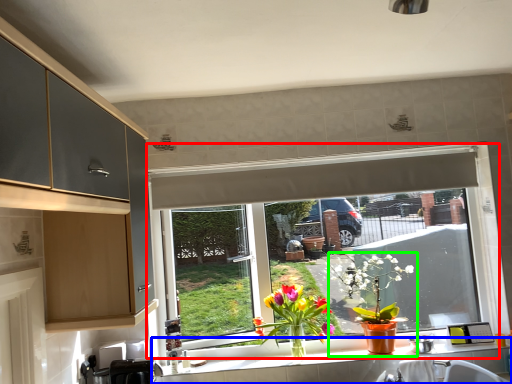
Question: Considering the real-world distances, which object is closest to window (highlighted by a red box)? countertop (highlighted by a blue box) or houseplant (highlighted by a green box).

Choices:
 (A) countertop
 (B) houseplant

Answer: (A)